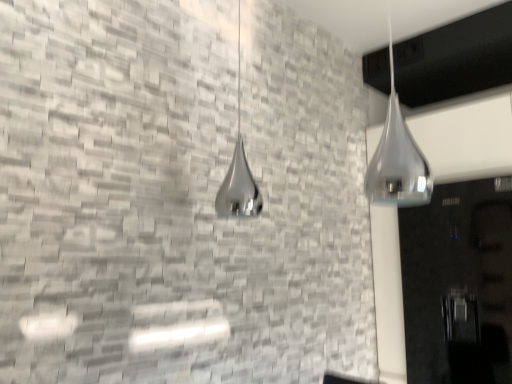
Question: Is glossy black door at right outside polished chrome shower at center, placed as the 1th shower when sorted from left to right?

Choices:
 (A) yes
 (B) no

Answer: (A)

Question: Does glossy black door at right have a greater width compared to polished chrome shower at center, placed as the 1th shower when sorted from left to right?

Choices:
 (A) yes
 (B) no

Answer: (A)

Question: From the image's perspective, would you say glossy black door at right is positioned over polished chrome shower at center, placed as the 1th shower when sorted from left to right?

Choices:
 (A) yes
 (B) no

Answer: (B)

Question: Does glossy black door at right contain polished chrome shower at center, acting as the 2th shower starting from the front?

Choices:
 (A) yes
 (B) no

Answer: (B)

Question: Is glossy black door at right not close to polished chrome shower at center, acting as the 2th shower starting from the front?

Choices:
 (A) no
 (B) yes

Answer: (B)

Question: From a real-world perspective, is glossy black door at right located beneath polished chrome shower at center, placed as the 1th shower when sorted from left to right?

Choices:
 (A) yes
 (B) no

Answer: (A)

Question: From a real-world perspective, is glossy black door at right physically above polished chrome shower at upper right, placed as the second shower when sorted from back to front?

Choices:
 (A) yes
 (B) no

Answer: (B)

Question: Considering the relative sizes of glossy black door at right and polished chrome shower at upper right, which is the first shower in front-to-back order, in the image provided, is glossy black door at right shorter than polished chrome shower at upper right, which is the first shower in front-to-back order,?

Choices:
 (A) no
 (B) yes

Answer: (A)

Question: Is the depth of glossy black door at right greater than that of polished chrome shower at upper right, which is the first shower in front-to-back order?

Choices:
 (A) yes
 (B) no

Answer: (A)

Question: Is glossy black door at right taller than polished chrome shower at upper right, which is the first shower in front-to-back order?

Choices:
 (A) yes
 (B) no

Answer: (A)

Question: Is glossy black door at right at the right side of polished chrome shower at upper right, placed as the second shower when sorted from back to front?

Choices:
 (A) yes
 (B) no

Answer: (A)

Question: Can you confirm if glossy black door at right is wider than polished chrome shower at upper right, the 2th shower positioned from the left?

Choices:
 (A) yes
 (B) no

Answer: (A)

Question: Can you confirm if polished chrome shower at upper right, the 2th shower positioned from the left, is thinner than polished chrome shower at center, acting as the 2th shower starting from the front?

Choices:
 (A) yes
 (B) no

Answer: (A)